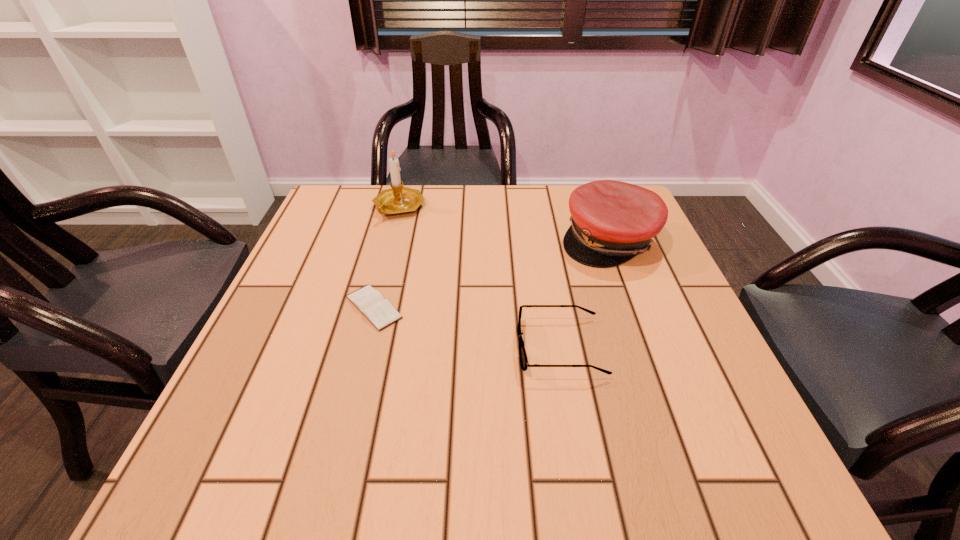
At what (x,y) coordinates should I click in order to perform the action: click on candle holder that is at the far edge. Please return your answer as a coordinate pair (x, y). Image resolution: width=960 pixels, height=540 pixels. Looking at the image, I should click on (398, 200).

You are a GUI agent. You are given a task and a screenshot of the screen. Output one action in this format:
    pyautogui.click(x=<x>, y=<y>)
    Task: Click on the cap that is at the far edge
    The width and height of the screenshot is (960, 540).
    Given the screenshot: What is the action you would take?
    pyautogui.click(x=611, y=221)

The image size is (960, 540). What are the coordinates of `candle holder that is at the left edge` in the screenshot? It's located at (398, 200).

Where is `diary that is at the left edge`? This screenshot has width=960, height=540. diary that is at the left edge is located at coordinates (370, 302).

Where is `object located in the right edge section of the desktop`? This screenshot has height=540, width=960. object located in the right edge section of the desktop is located at coordinates (611, 221).

Identify the location of object present at the far left corner. The height and width of the screenshot is (540, 960). (398, 200).

This screenshot has width=960, height=540. I want to click on object at the far right corner, so click(611, 221).

Image resolution: width=960 pixels, height=540 pixels. Find the location of `free space at the far edge of the desktop`. free space at the far edge of the desktop is located at coordinates (509, 186).

In the image, there is a desktop. Where is `free space at the near edge`? This screenshot has width=960, height=540. free space at the near edge is located at coordinates (399, 453).

In order to click on vacant space at the left edge of the desktop in this screenshot , I will do `click(310, 303)`.